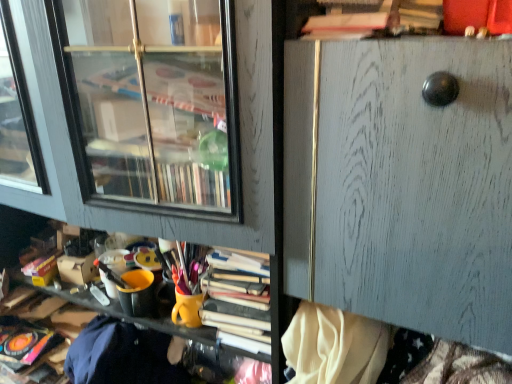
Question: Considering the positions of wooden shelf at center and wooden file cabinet at center in the image, is wooden shelf at center wider or thinner than wooden file cabinet at center?

Choices:
 (A) wide
 (B) thin

Answer: (A)

Question: From the image's perspective, is wooden shelf at center located above or below wooden file cabinet at center?

Choices:
 (A) above
 (B) below

Answer: (B)

Question: Is wooden shelf at center taller or shorter than wooden file cabinet at center?

Choices:
 (A) short
 (B) tall

Answer: (B)

Question: Based on their positions, is wooden file cabinet at center located to the left or right of wooden shelf at center?

Choices:
 (A) left
 (B) right

Answer: (B)

Question: From a real-world perspective, is wooden file cabinet at center physically located above or below wooden shelf at center?

Choices:
 (A) above
 (B) below

Answer: (A)

Question: In terms of width, does wooden file cabinet at center look wider or thinner when compared to wooden shelf at center?

Choices:
 (A) wide
 (B) thin

Answer: (B)

Question: Considering their positions, is wooden file cabinet at center located in front of or behind wooden shelf at center?

Choices:
 (A) front
 (B) behind

Answer: (A)